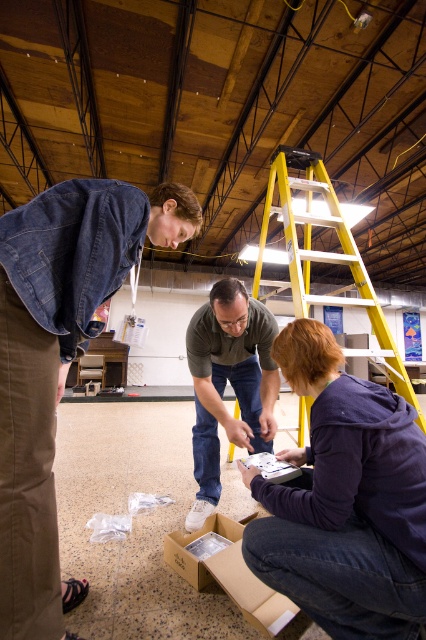
You are a new member joining the group in the workshop. You need to hand a tool to the person with the purple fleece jacket at lower center. Which direction should you walk to reach them first before the yellow metallic ladder at upper center?

The purple fleece jacket at lower center is located below the yellow metallic ladder at upper center, so you should walk towards the lower area to reach the person with the purple fleece jacket at lower center before reaching the yellow metallic ladder at upper center.

You are a photographer standing at the entrance of the workshop. You want to take a photo that includes both the matte gray shirt at center and the brown cardboard box at lower center. Which object should you focus on first to ensure both are in frame?

The matte gray shirt at center is taller than the brown cardboard box at lower center, so you should focus on the matte gray shirt at center first to ensure both are in frame.